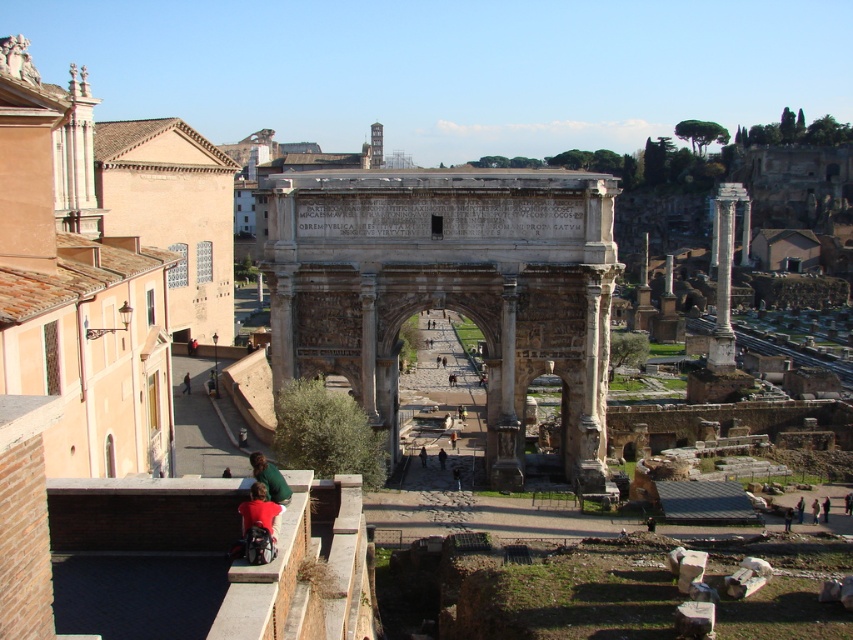
Based on the photo, can you confirm if white marble column at right is positioned to the left of dark brown fabric at center?

Incorrect, white marble column at right is not on the left side of dark brown fabric at center.

Which is below, white marble column at right or dark brown fabric at center?

dark brown fabric at center is lower down.

Find the location of `white marble column at right`. white marble column at right is located at coordinates (724, 280).

Does stone archway at center have a greater width compared to green fabric at lower center?

Correct, the width of stone archway at center exceeds that of green fabric at lower center.

Does stone archway at center lie behind green fabric at lower center?

Yes, it is.

This screenshot has height=640, width=853. Find the location of `stone archway at center`. stone archway at center is located at coordinates (450, 291).

Find the location of `stone archway at center`. stone archway at center is located at coordinates (450, 291).

Who is more distant from viewer, (601, 422) or (445, 456)?

Point (445, 456)

Does stone archway at center have a lesser height compared to dark brown fabric at center?

In fact, stone archway at center may be taller than dark brown fabric at center.

Where is `stone archway at center`? The height and width of the screenshot is (640, 853). stone archway at center is located at coordinates (450, 291).

Find the location of `stone archway at center`. stone archway at center is located at coordinates (450, 291).